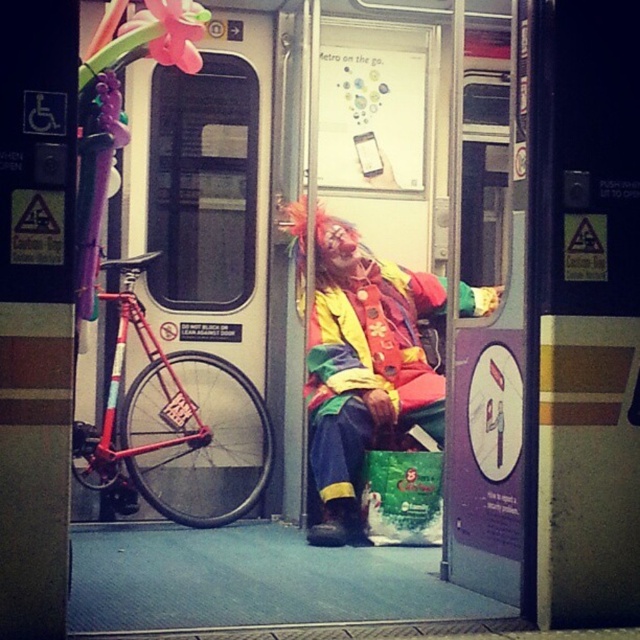
Question: Does matte clown costume at center have a lesser width compared to shiny red bicycle at left?

Choices:
 (A) yes
 (B) no

Answer: (B)

Question: Which object is farther from the camera taking this photo?

Choices:
 (A) shiny red bicycle at left
 (B) matte clown costume at center

Answer: (A)

Question: Is matte clown costume at center bigger than shiny red bicycle at left?

Choices:
 (A) yes
 (B) no

Answer: (A)

Question: Which point is closer to the camera?

Choices:
 (A) matte clown costume at center
 (B) shiny red bicycle at left

Answer: (A)

Question: Does matte clown costume at center appear on the right side of shiny red bicycle at left?

Choices:
 (A) no
 (B) yes

Answer: (B)